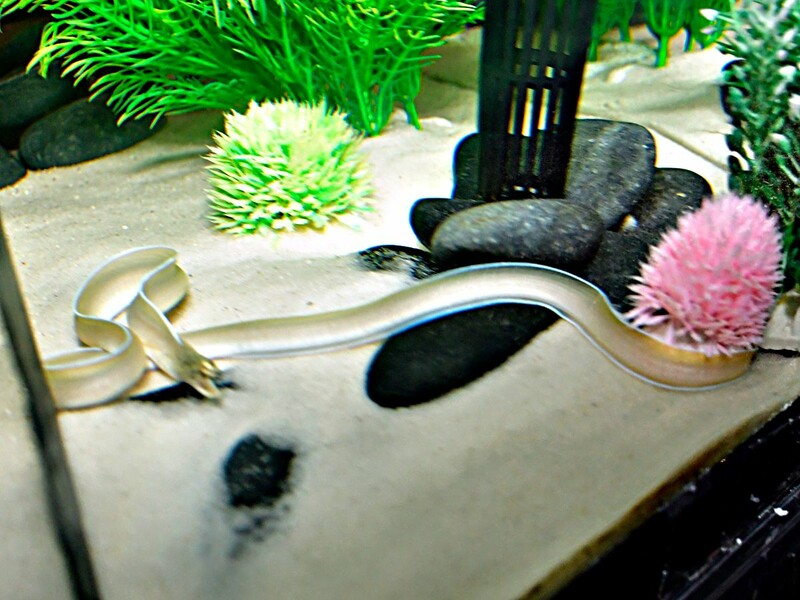
Where is `smooth black decorative rocks`? Image resolution: width=800 pixels, height=600 pixels. smooth black decorative rocks is located at coordinates 546,242, 590,156, 648,223, 430,221, 74,135, 32,103, 12,169.